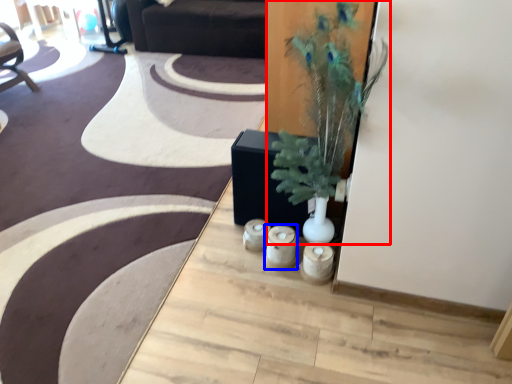
Question: Which of the following is the farthest to the observer, houseplant (highlighted by a red box) or candle holder (highlighted by a blue box)?

Choices:
 (A) houseplant
 (B) candle holder

Answer: (B)